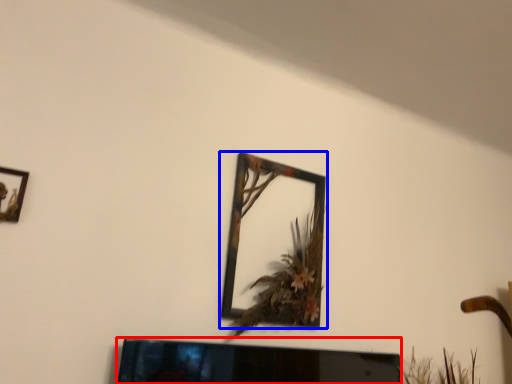
Question: Which object is closer to the camera taking this photo, television (highlighted by a red box) or picture frame (highlighted by a blue box)?

Choices:
 (A) television
 (B) picture frame

Answer: (A)